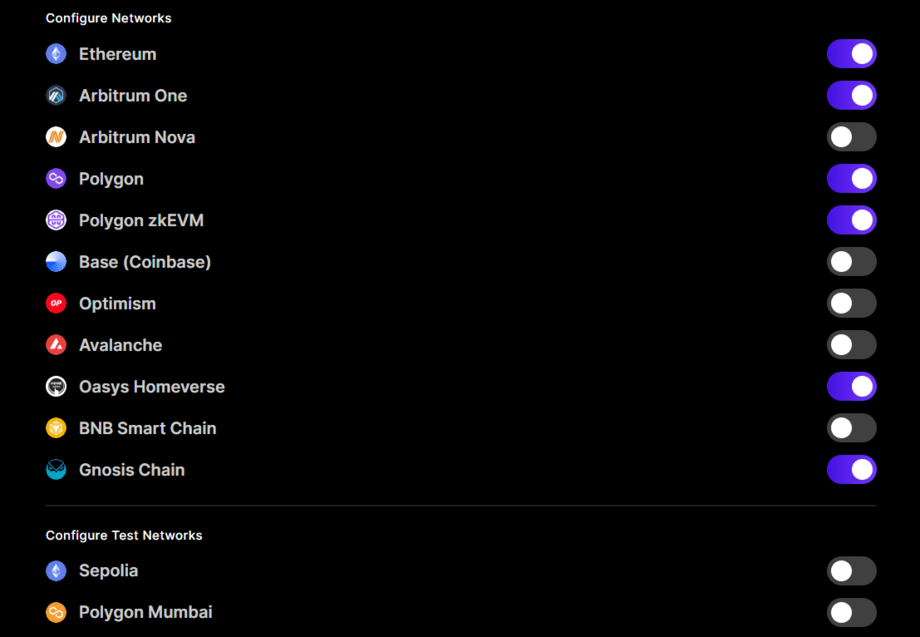
This screenshot has height=637, width=920. In order to click on switches that are on in this screenshot , I will do `click(844, 469)`, `click(840, 390)`, `click(841, 217)`, `click(845, 180)`, `click(840, 97)`, `click(851, 60)`.